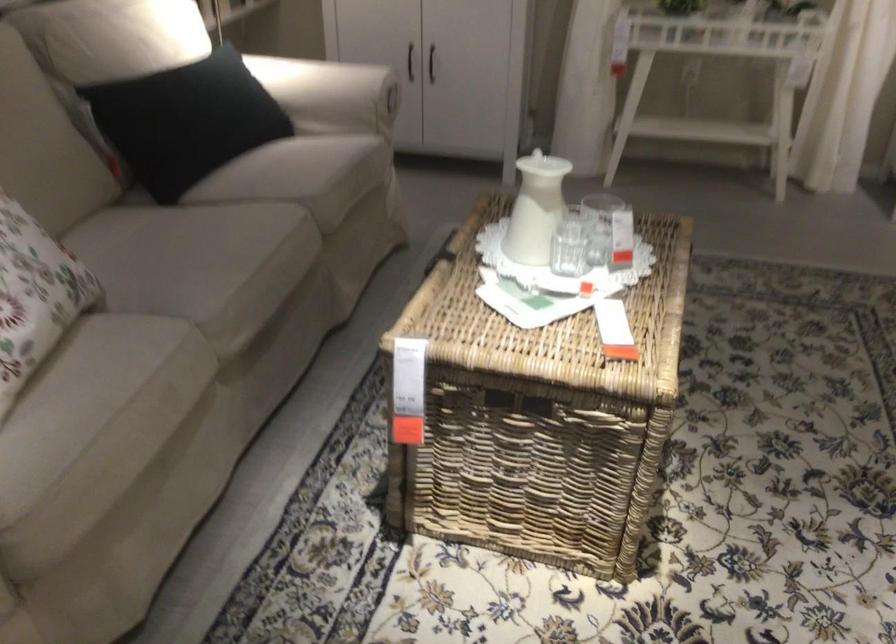
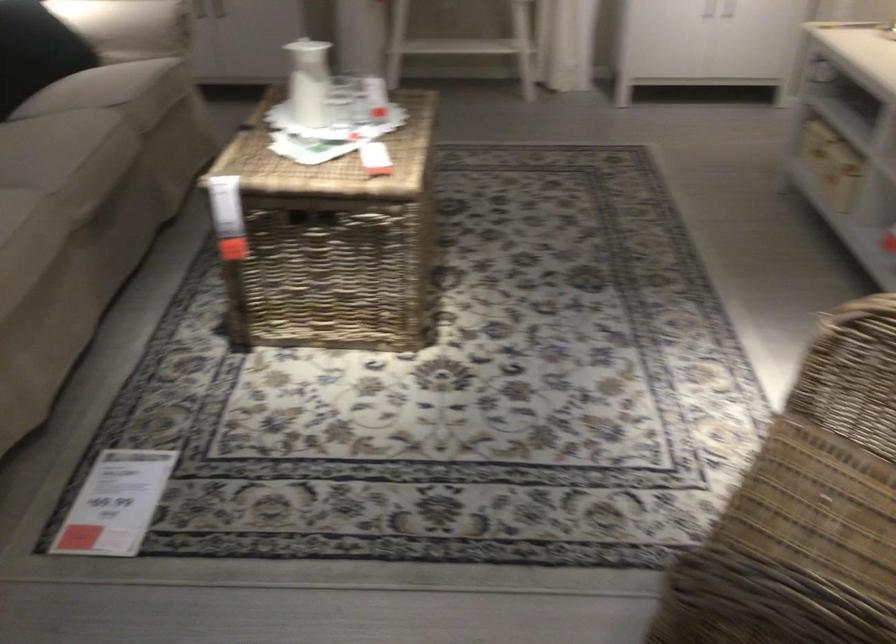
In the second image, find the point that corresponds to point 277,248 in the first image.

(109, 140)